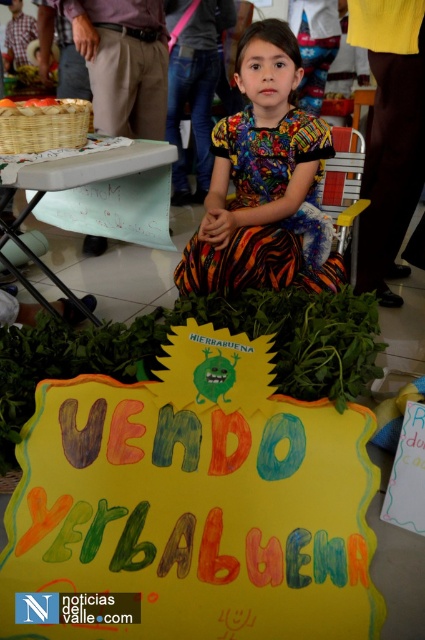
Question: Is multicolored fabric dress at center wider than green painted plastic table at lower left?

Choices:
 (A) no
 (B) yes

Answer: (B)

Question: Estimate the real-world distances between objects in this image. Which object is closer to the multicolored fabric dress at center?

Choices:
 (A) green painted plastic table at lower left
 (B) hand-painted cardboard sign at center

Answer: (A)

Question: Which point is closer to the camera?

Choices:
 (A) hand-painted cardboard sign at center
 (B) green painted plastic table at lower left

Answer: (A)

Question: Can you confirm if hand-painted cardboard sign at center is bigger than multicolored fabric dress at center?

Choices:
 (A) yes
 (B) no

Answer: (B)

Question: Does hand-painted cardboard sign at center lie in front of multicolored fabric dress at center?

Choices:
 (A) yes
 (B) no

Answer: (A)

Question: Estimate the real-world distances between objects in this image. Which object is closer to the multicolored fabric dress at center?

Choices:
 (A) hand-painted cardboard sign at center
 (B) green painted plastic table at lower left

Answer: (B)